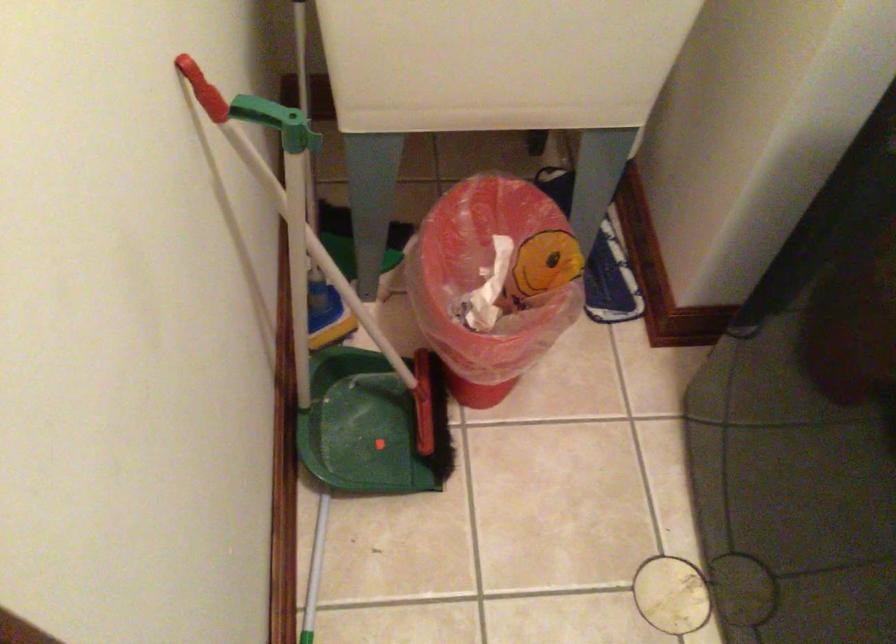
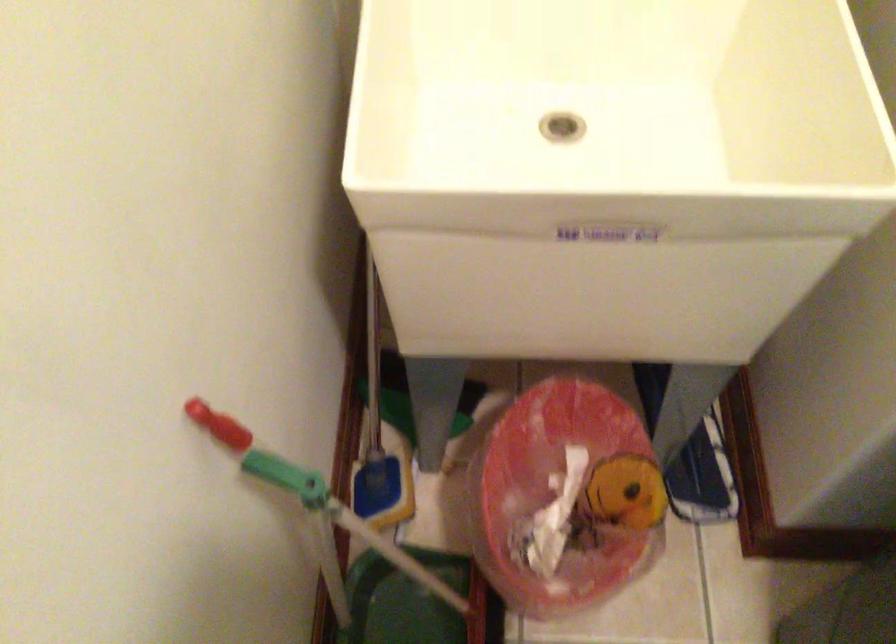
Question: The first image is from the beginning of the video and the second image is from the end. How did the camera likely rotate when shooting the video?

Choices:
 (A) Left
 (B) Right
 (C) Up
 (D) Down

Answer: (A)